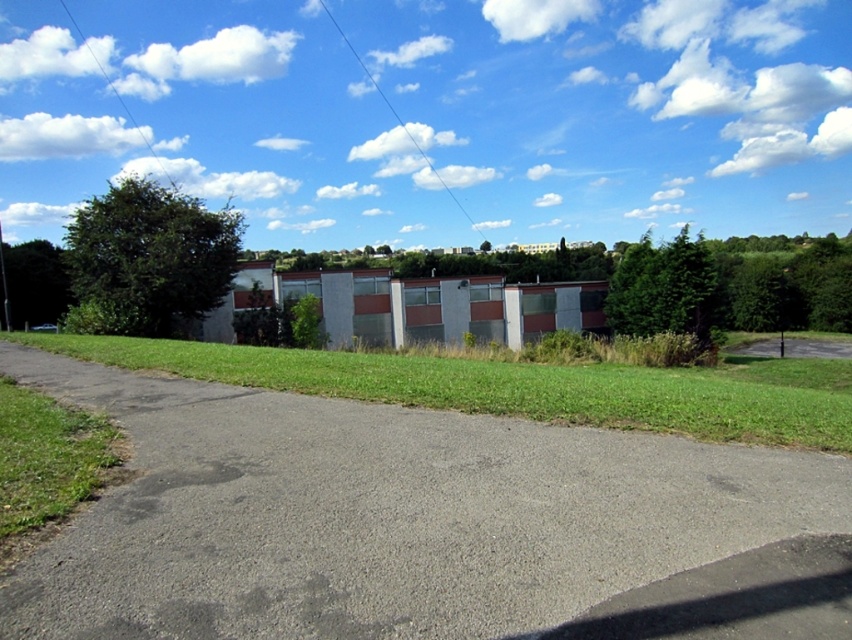
Is point (684, 300) positioned after point (52, 288)?

No.

Can you confirm if green leafy tree at center-right is positioned to the right of green leafy tree at left?

Yes, green leafy tree at center-right is to the right of green leafy tree at left.

Where is `green leafy tree at center-right`? green leafy tree at center-right is located at coordinates (663, 289).

At what (x,y) coordinates should I click in order to perform the action: click on green leafy tree at center-right. Please return your answer as a coordinate pair (x, y). This screenshot has height=640, width=852. Looking at the image, I should click on (663, 289).

Is green leafy tree at upper left below green leafy tree at left?

No.

Which is behind, point (131, 196) or point (52, 289)?

The point (52, 289) is behind.

Image resolution: width=852 pixels, height=640 pixels. Find the location of `green leafy tree at upper left`. green leafy tree at upper left is located at coordinates (147, 259).

How distant is gray asphalt driveway at center from green grass at lower center?

gray asphalt driveway at center is 7.88 meters away from green grass at lower center.

Is gray asphalt driveway at center behind green grass at lower center?

No, it is in front of green grass at lower center.

The image size is (852, 640). Describe the element at coordinates (423, 524) in the screenshot. I see `gray asphalt driveway at center` at that location.

The width and height of the screenshot is (852, 640). In order to click on gray asphalt driveway at center in this screenshot , I will do `click(423, 524)`.